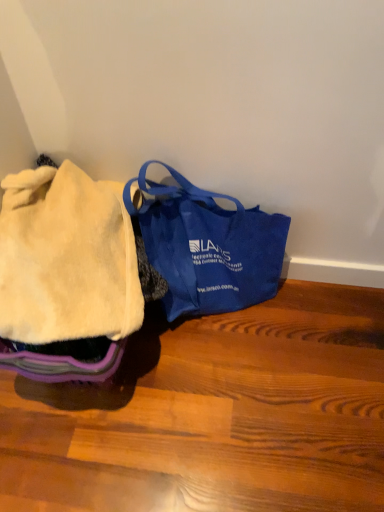
Question: From a real-world perspective, relative to blue canvas bag at center, is fuzzy cream blanket at left vertically above or below?

Choices:
 (A) below
 (B) above

Answer: (B)

Question: From their relative heights in the image, would you say fuzzy cream blanket at left is taller or shorter than blue canvas bag at center?

Choices:
 (A) short
 (B) tall

Answer: (A)

Question: Is fuzzy cream blanket at left in front of or behind blue canvas bag at center in the image?

Choices:
 (A) front
 (B) behind

Answer: (A)

Question: From a real-world perspective, relative to fuzzy cream blanket at left, is blue canvas bag at center vertically above or below?

Choices:
 (A) below
 (B) above

Answer: (A)

Question: Considering the positions of point (147, 258) and point (1, 283), is point (147, 258) closer or farther from the camera than point (1, 283)?

Choices:
 (A) closer
 (B) farther

Answer: (B)

Question: In terms of size, does blue canvas bag at center appear bigger or smaller than fuzzy cream blanket at left?

Choices:
 (A) small
 (B) big

Answer: (B)

Question: In the image, is blue canvas bag at center positioned in front of or behind fuzzy cream blanket at left?

Choices:
 (A) behind
 (B) front

Answer: (A)